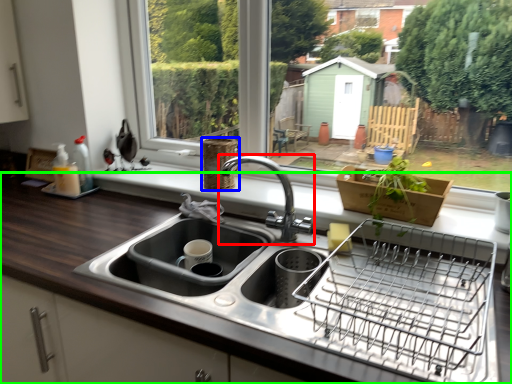
Question: Based on their relative distances, which object is nearer to tap (highlighted by a red box)? Choose from basket (highlighted by a blue box) and countertop (highlighted by a green box).

Choices:
 (A) basket
 (B) countertop

Answer: (A)